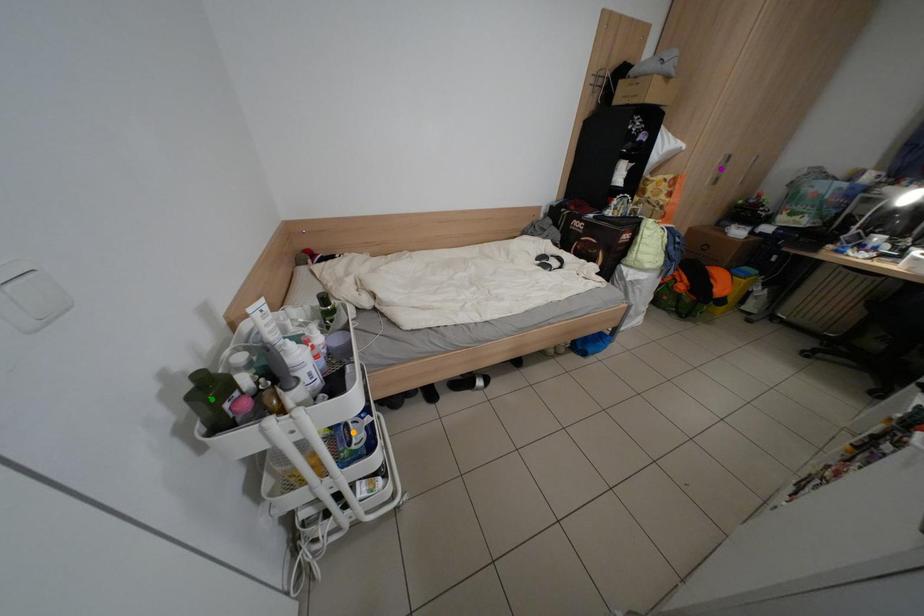
Order these from nearest to farthest:
A) green point
B) orange point
C) purple point

purple point
orange point
green point